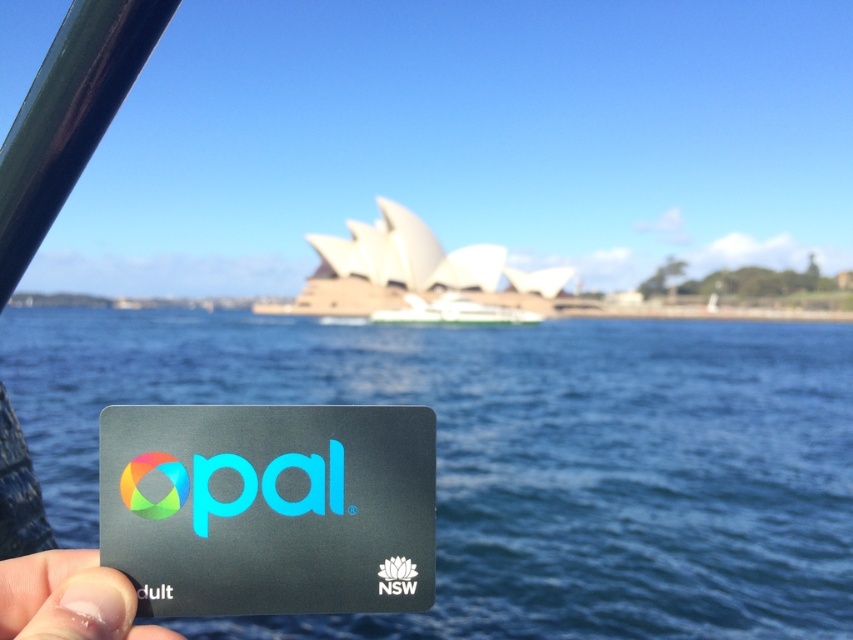
Between point (624, 544) and point (405, 584), which one is positioned in front?

Positioned in front is point (405, 584).

Identify the location of transparent water at center. The width and height of the screenshot is (853, 640). (515, 458).

Between point (784, 570) and point (428, 515), which one is positioned in front?

Point (428, 515) is more forward.

What do you see at coordinates (515, 458) in the screenshot?
I see `transparent water at center` at bounding box center [515, 458].

Is point (541, 435) positioned after point (395, 451)?

That is True.

I want to click on transparent water at center, so click(515, 458).

Between point (756, 440) and point (68, 552), which one is positioned behind?

The point (756, 440) is more distant.

Between transparent water at center and finger nail at lower left, which one is positioned lower?

transparent water at center

Is point (670, 376) closer to camera compared to point (106, 595)?

No, (670, 376) is behind (106, 595).

Locate an element on the screen. This screenshot has width=853, height=640. transparent water at center is located at coordinates (515, 458).